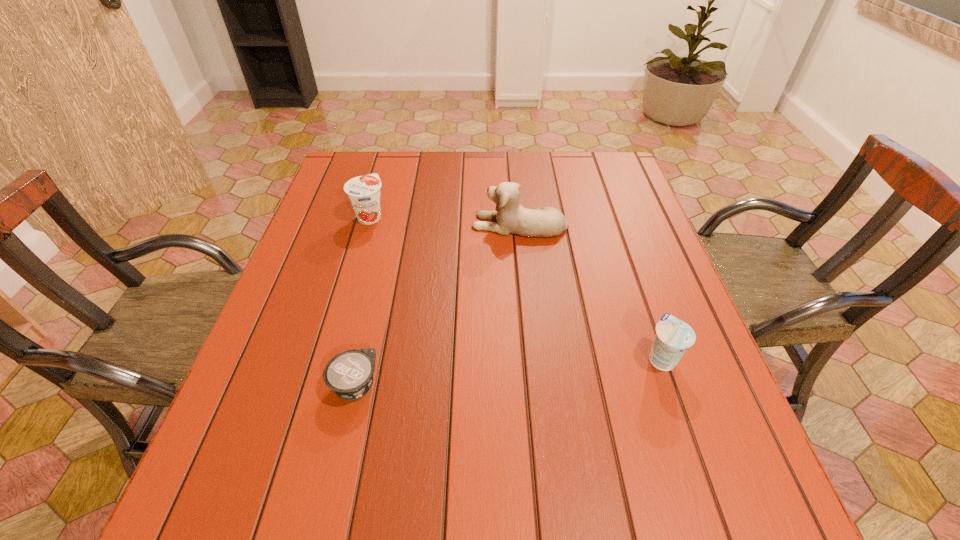
What are the coordinates of `the tallest object` in the screenshot? It's located at (512, 218).

You are a GUI agent. You are given a task and a screenshot of the screen. Output one action in this format:
    pyautogui.click(x=<x>, y=<y>)
    Task: Click on the third object from left to right
    The height and width of the screenshot is (540, 960).
    Given the screenshot: What is the action you would take?
    pyautogui.click(x=512, y=218)

Identify the location of the farthest yogurt. This screenshot has width=960, height=540. (364, 191).

Locate an element on the screen. the rightmost yogurt is located at coordinates [x=673, y=337].

Where is `the shortest object`? This screenshot has height=540, width=960. the shortest object is located at coordinates (349, 374).

In order to click on blank space located 0.360m on the front-facing side of the third object from left to right in this screenshot , I will do `click(339, 224)`.

The width and height of the screenshot is (960, 540). Identify the location of free space located on the front-facing side of the third object from left to right. (368, 224).

In order to click on vacant area situated 0.310m on the front-facing side of the third object from left to right in this screenshot , I will do `click(357, 224)`.

The width and height of the screenshot is (960, 540). Identify the location of vacant space located 0.370m on the front of the farthest yogurt. (334, 340).

Locate an element on the screen. free space located on the front of the rightmost yogurt is located at coordinates (686, 430).